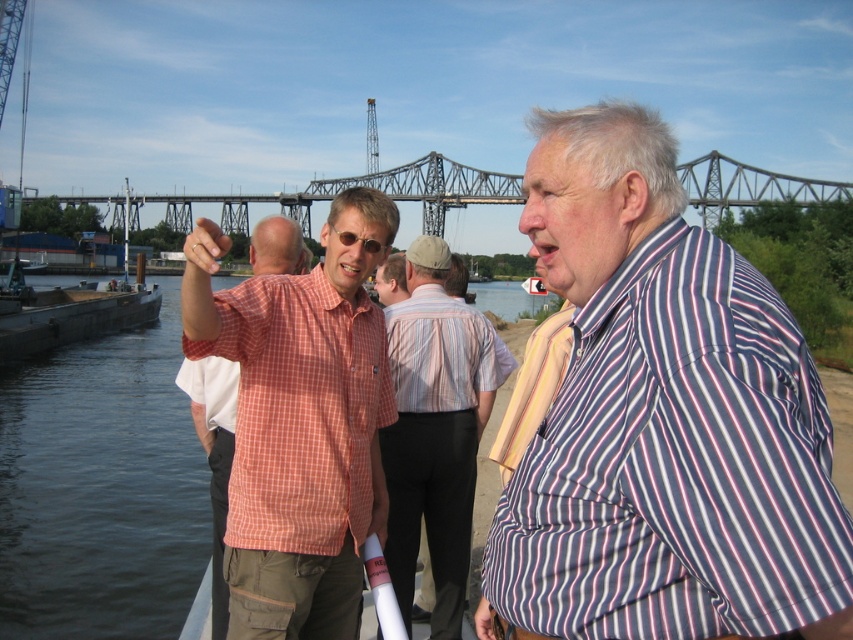
Is checkered fabric shirt at center positioned at the back of striped cotton shirt at center?

No, checkered fabric shirt at center is in front of striped cotton shirt at center.

Image resolution: width=853 pixels, height=640 pixels. I want to click on checkered fabric shirt at center, so click(300, 420).

The height and width of the screenshot is (640, 853). What are the coordinates of `checkered fabric shirt at center` in the screenshot? It's located at (300, 420).

Which is more to the left, striped cotton shirt at right or metallic gray bridge at upper center?

From the viewer's perspective, metallic gray bridge at upper center appears more on the left side.

This screenshot has width=853, height=640. Describe the element at coordinates (663, 419) in the screenshot. I see `striped cotton shirt at right` at that location.

This screenshot has height=640, width=853. In order to click on striped cotton shirt at right in this screenshot , I will do `click(663, 419)`.

Between point (675, 568) and point (422, 308), which one is positioned in front?

Positioned in front is point (675, 568).

Between striped cotton shirt at right and striped cotton shirt at center, which one is positioned lower?

striped cotton shirt at center

Is point (540, 600) farther from viewer compared to point (497, 355)?

No, it is not.

At what (x,y) coordinates should I click in order to perform the action: click on striped cotton shirt at right. Please return your answer as a coordinate pair (x, y). Image resolution: width=853 pixels, height=640 pixels. Looking at the image, I should click on (663, 419).